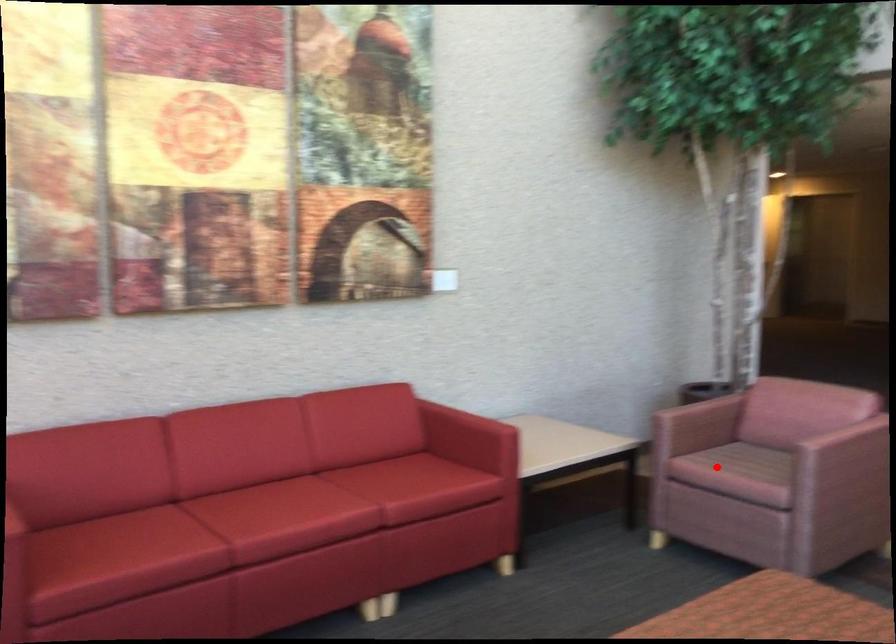
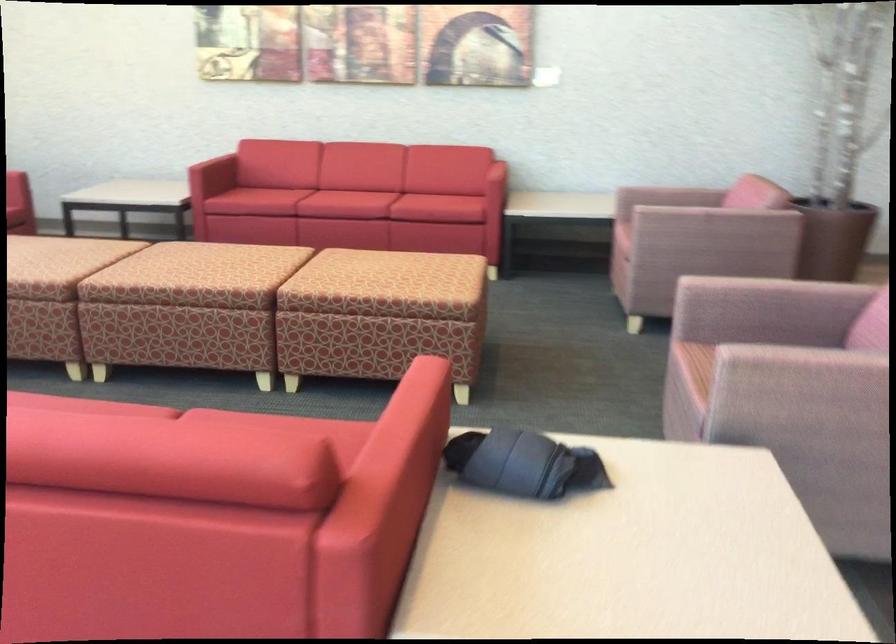
Locate, in the second image, the point that corresponds to the highlighted location in the first image.

(624, 218)